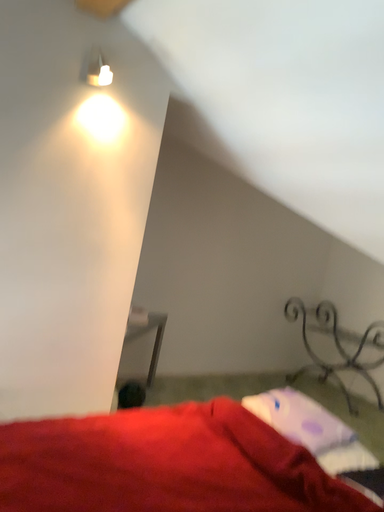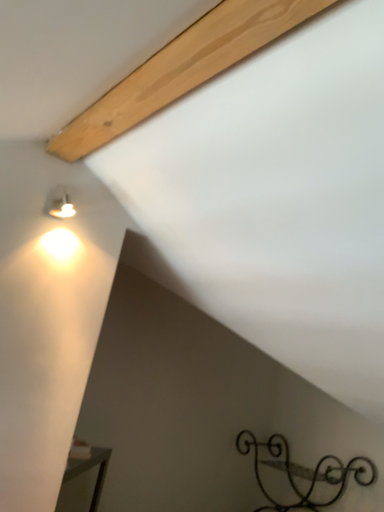
Question: Which way did the camera rotate in the video?

Choices:
 (A) rotated left
 (B) rotated right

Answer: (B)